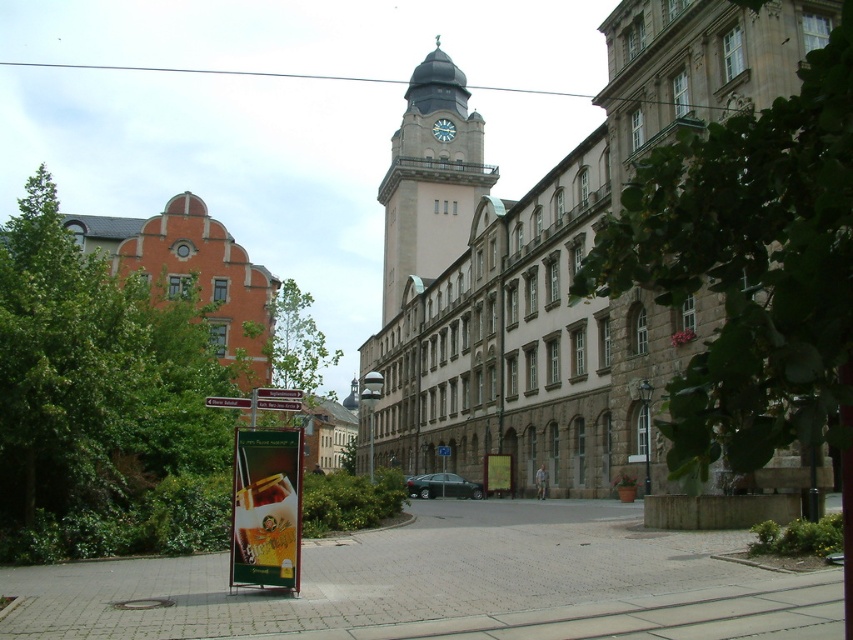
Which is more to the right, green leafy tree at center or white wooden clock at upper center?

Positioned to the right is green leafy tree at center.

Who is taller, green leafy tree at center or white wooden clock at upper center?

With more height is green leafy tree at center.

The height and width of the screenshot is (640, 853). Find the location of `green leafy tree at center`. green leafy tree at center is located at coordinates (747, 266).

Can you confirm if green leafy tree at center is positioned to the right of red plastic sign at center?

Yes, green leafy tree at center is to the right of red plastic sign at center.

Which is more to the left, green leafy tree at center or red plastic sign at center?

red plastic sign at center

Does point (729, 140) come closer to viewer compared to point (242, 404)?

Yes, it is in front of point (242, 404).

This screenshot has width=853, height=640. Find the location of `green leafy tree at center`. green leafy tree at center is located at coordinates (747, 266).

Between smooth stone clock tower at center and green plastic sign at lower left, which one appears on the right side from the viewer's perspective?

From the viewer's perspective, green plastic sign at lower left appears more on the right side.

Is smooth stone clock tower at center thinner than green plastic sign at lower left?

Incorrect, smooth stone clock tower at center's width is not less than green plastic sign at lower left's.

At what (x,y) coordinates should I click in order to perform the action: click on smooth stone clock tower at center. Please return your answer as a coordinate pair (x, y). Looking at the image, I should click on (430, 179).